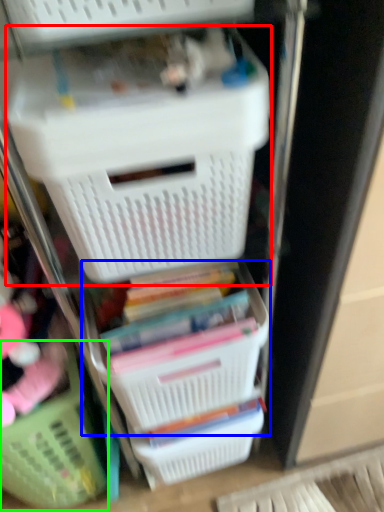
Question: Estimate the real-world distances between objects in this image. Which object is closer to storage box (highlighted by a red box), basket (highlighted by a blue box) or basket (highlighted by a green box)?

Choices:
 (A) basket
 (B) basket

Answer: (A)